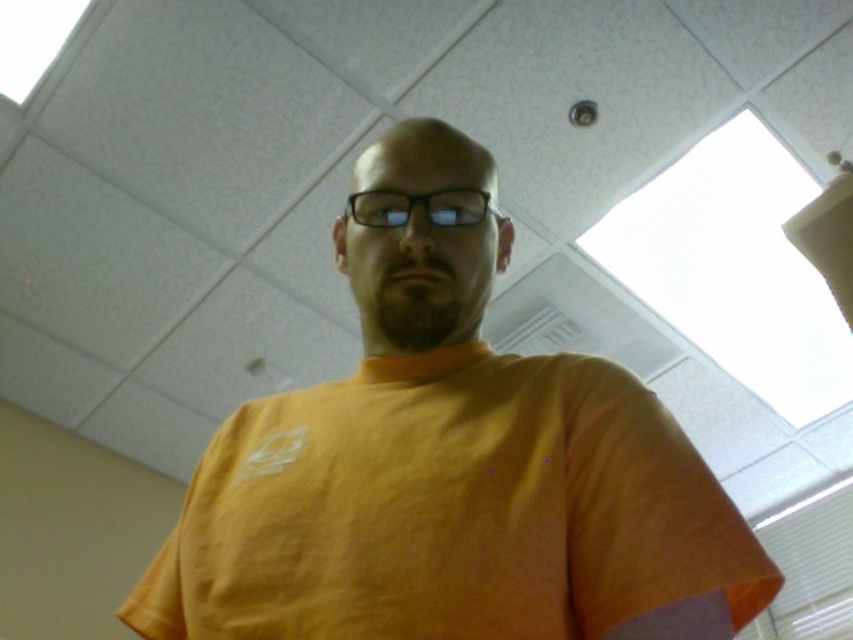
You are standing in a room with a light yellow wall and a ceiling with white acoustic tiles. You see a person wearing an orange t shirt at center. Where is the orange t shirt located in relation to the point marked at coordinates (451, 486)?

The orange t shirt at center is located exactly at the point marked at coordinates (451, 486).